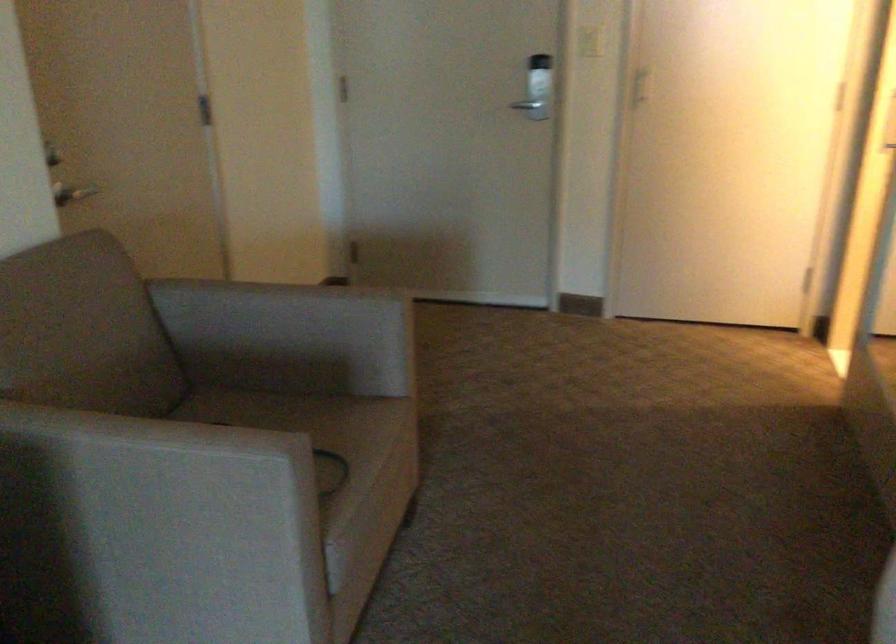
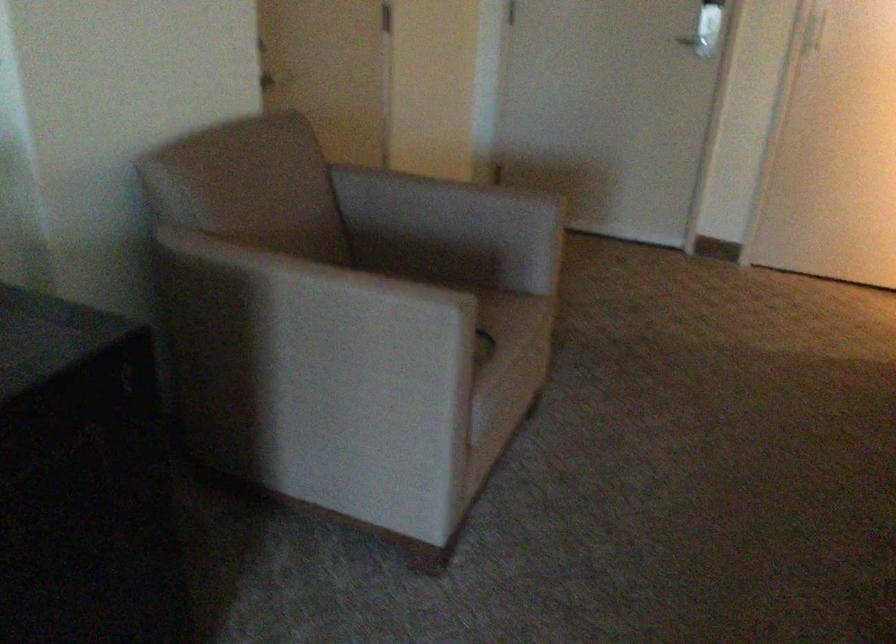
Question: The first image is from the beginning of the video and the second image is from the end. How did the camera likely rotate when shooting the video?

Choices:
 (A) Left
 (B) Right
 (C) Up
 (D) Down

Answer: (A)